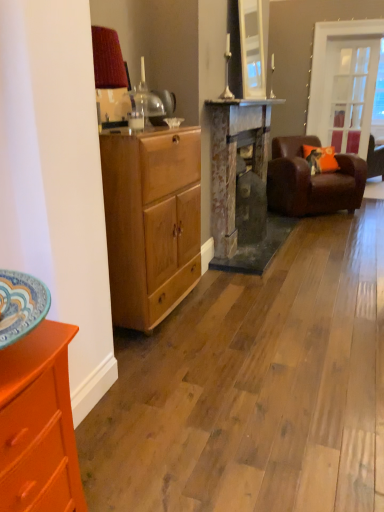
Question: Considering the relative sizes of clear glass door at upper right and rusty metal fireplace at center in the image provided, is clear glass door at upper right taller than rusty metal fireplace at center?

Choices:
 (A) yes
 (B) no

Answer: (A)

Question: Is clear glass door at upper right oriented towards rusty metal fireplace at center?

Choices:
 (A) no
 (B) yes

Answer: (A)

Question: Is clear glass door at upper right behind rusty metal fireplace at center?

Choices:
 (A) yes
 (B) no

Answer: (A)

Question: Considering the relative positions of clear glass door at upper right and rusty metal fireplace at center in the image provided, is clear glass door at upper right to the left of rusty metal fireplace at center from the viewer's perspective?

Choices:
 (A) yes
 (B) no

Answer: (B)

Question: Can you confirm if clear glass door at upper right is bigger than rusty metal fireplace at center?

Choices:
 (A) no
 (B) yes

Answer: (A)

Question: Is brown leather couch at right situated inside clear glass door at upper right or outside?

Choices:
 (A) inside
 (B) outside

Answer: (B)

Question: Looking at their shapes, would you say brown leather couch at right is wider or thinner than clear glass door at upper right?

Choices:
 (A) wide
 (B) thin

Answer: (A)

Question: From their relative heights in the image, would you say brown leather couch at right is taller or shorter than clear glass door at upper right?

Choices:
 (A) tall
 (B) short

Answer: (B)

Question: From a real-world perspective, is brown leather couch at right physically located above or below clear glass door at upper right?

Choices:
 (A) below
 (B) above

Answer: (A)

Question: Choose the correct answer: Is clear glass door at upper right inside brown leather couch at right or outside it?

Choices:
 (A) outside
 (B) inside

Answer: (A)

Question: From the image's perspective, is clear glass door at upper right above or below brown leather couch at right?

Choices:
 (A) below
 (B) above

Answer: (B)

Question: Is clear glass door at upper right wider or thinner than brown leather couch at right?

Choices:
 (A) thin
 (B) wide

Answer: (A)

Question: Looking at the image, does clear glass door at upper right seem bigger or smaller compared to brown leather couch at right?

Choices:
 (A) small
 (B) big

Answer: (A)

Question: Looking at the image, does rusty metal fireplace at center seem bigger or smaller compared to brown leather couch at right?

Choices:
 (A) small
 (B) big

Answer: (A)

Question: From the image's perspective, relative to brown leather couch at right, is rusty metal fireplace at center above or below?

Choices:
 (A) below
 (B) above

Answer: (A)